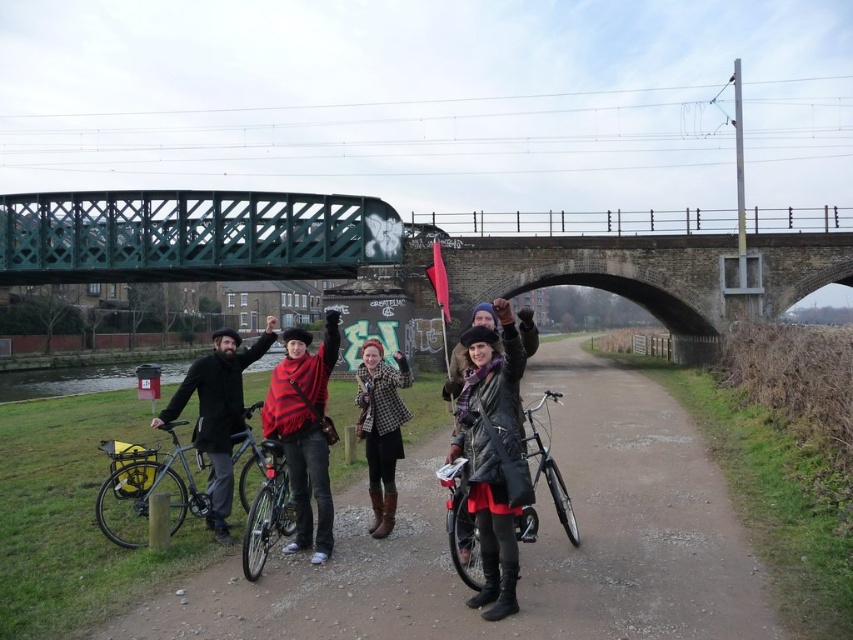
Is green metal bridge at upper center thinner than shiny silver bicycle at center?

No, green metal bridge at upper center is not thinner than shiny silver bicycle at center.

Between green metal bridge at upper center and shiny silver bicycle at center, which one appears on the left side from the viewer's perspective?

From the viewer's perspective, green metal bridge at upper center appears more on the left side.

Between point (64, 248) and point (444, 465), which one is positioned behind?

Positioned behind is point (64, 248).

The height and width of the screenshot is (640, 853). What are the coordinates of `green metal bridge at upper center` in the screenshot? It's located at (190, 236).

Who is higher up, stone arch bridge at center or shiny metallic bicycle at center?

Positioned higher is stone arch bridge at center.

Does point (699, 273) come in front of point (250, 563)?

No.

You are a GUI agent. You are given a task and a screenshot of the screen. Output one action in this format:
    pyautogui.click(x=<x>, y=<y>)
    Task: Click on the stone arch bridge at center
    Image resolution: width=853 pixels, height=640 pixels.
    Given the screenshot: What is the action you would take?
    pyautogui.click(x=634, y=266)

Does dirt path at center have a lesser height compared to shiny silver bicycle at center?

Yes, dirt path at center is shorter than shiny silver bicycle at center.

Is dirt path at center above shiny silver bicycle at center?

No.

Does point (637, 548) lie behind point (474, 586)?

Yes, point (637, 548) is farther from viewer.

Find the location of `dirt path at center`. dirt path at center is located at coordinates (520, 547).